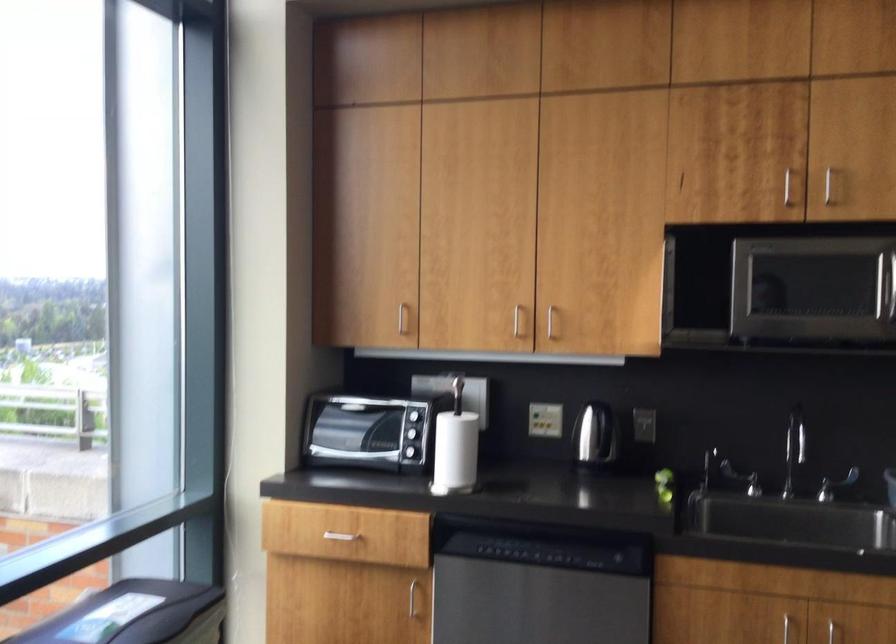
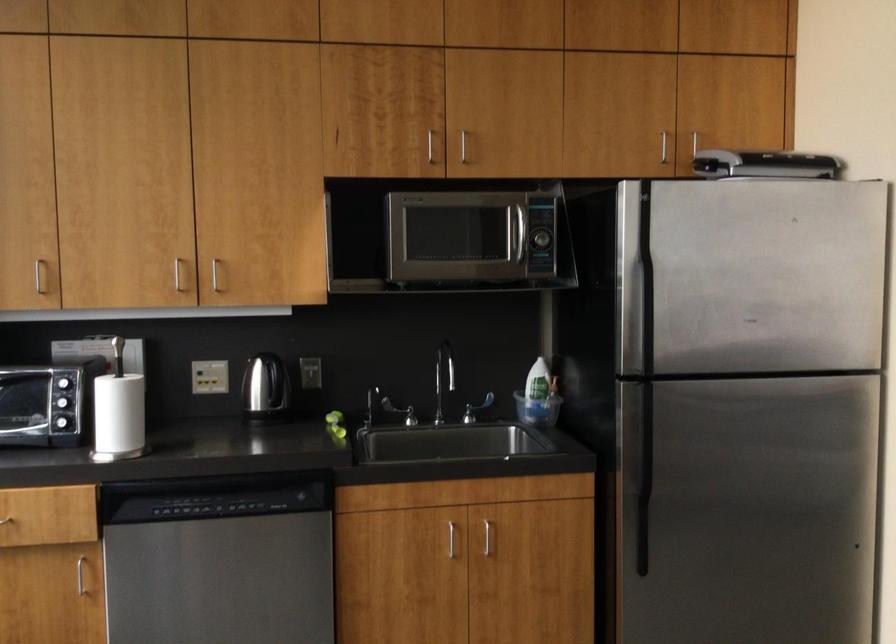
Find the pixel in the second image that matches (x=521, y=516) in the first image.

(208, 471)